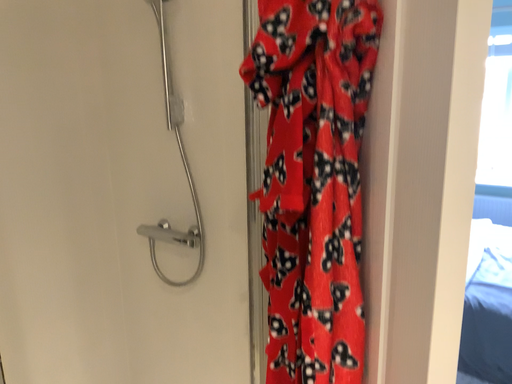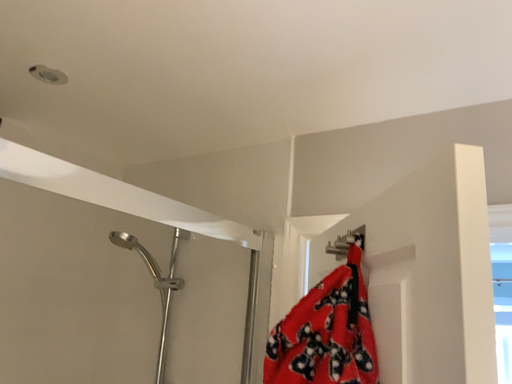
Question: Which way did the camera rotate in the video?

Choices:
 (A) rotated upward
 (B) rotated downward

Answer: (A)